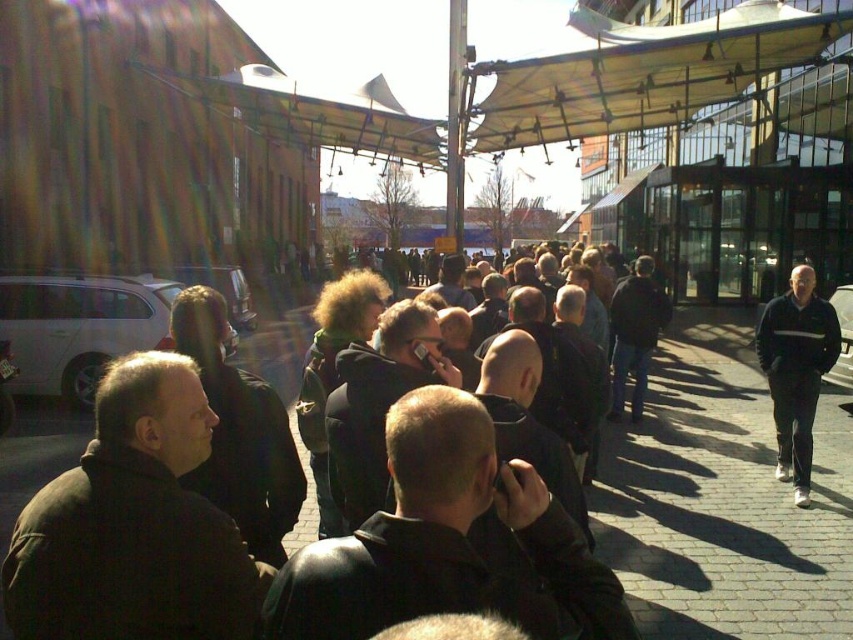
You are standing in the crowd and want to move from the point at coordinates (704, 44) to the point at coordinates (782, 436). Which direction should you move to get closer to your destination?

Since point (704, 44) is further to the viewer than point (782, 436), you should move forward to get closer to your destination.